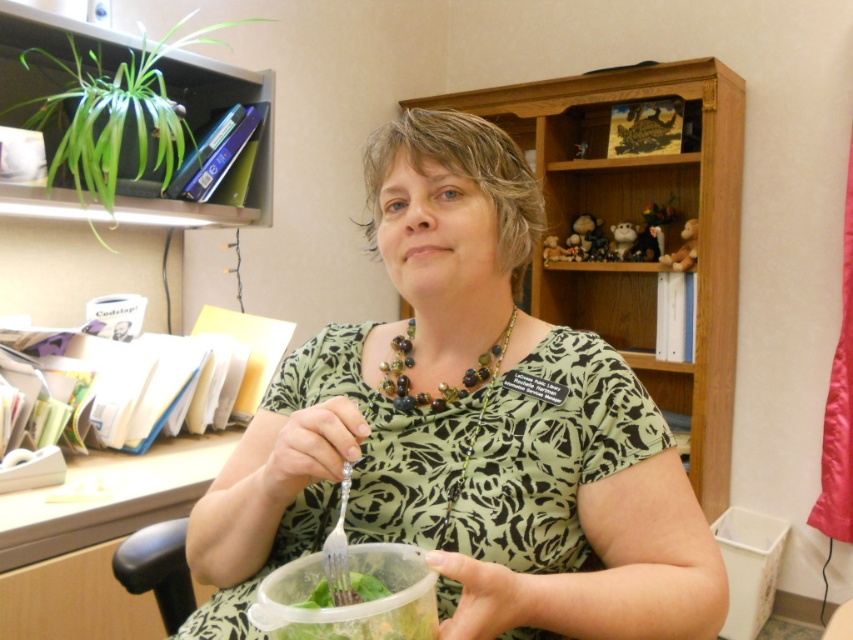
You are an office worker who needs to place a new folder on the wooden desk at left. However, there is a multicolored beaded necklace at center in the way. To reach the desk, which direction should you move the necklace?

The wooden desk at left is to the left of the multicolored beaded necklace at center. Therefore, you should move the multicolored beaded necklace at center to the right to access the wooden desk at left.

You are an office worker who needs to determine if the green floral shirt at center can be placed inside the transparent plastic bowl at lower center. Based on their sizes, is this possible?

The green floral shirt at center is taller than the transparent plastic bowl at lower center, so it cannot be placed inside the transparent plastic bowl at lower center.